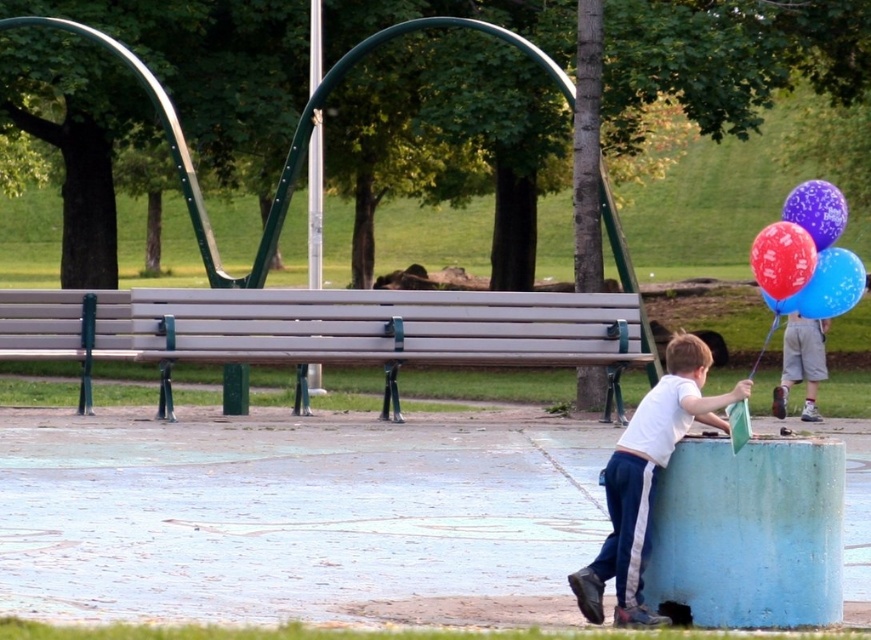
Question: Among these objects, which one is farthest from the camera?

Choices:
 (A) light brown shorts at right
 (B) blue glossy balloon at upper right
 (C) matte metallic balloons at right

Answer: (A)

Question: Observing the image, what is the correct spatial positioning of wooden bench at center in reference to white matte shirt at lower right?

Choices:
 (A) right
 (B) left

Answer: (B)

Question: Among these points, which one is farthest from the camera?

Choices:
 (A) (773, 288)
 (B) (845, 205)
 (C) (781, 406)

Answer: (C)

Question: From the image, what is the correct spatial relationship of brushed metal pole at center in relation to light brown shorts at right?

Choices:
 (A) left
 (B) right

Answer: (A)

Question: Which of these objects is positioned closest to the brushed metal pole at center?

Choices:
 (A) matte metallic balloons at right
 (B) shiny red balloon at upper right

Answer: (A)

Question: Can you confirm if white matte shirt at lower right is bigger than light brown shorts at right?

Choices:
 (A) no
 (B) yes

Answer: (B)